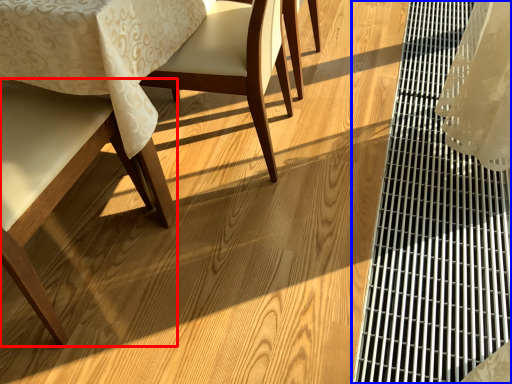
Question: Which of the following is the farthest to the observer, chair (highlighted by a red box) or table (highlighted by a blue box)?

Choices:
 (A) chair
 (B) table

Answer: (B)